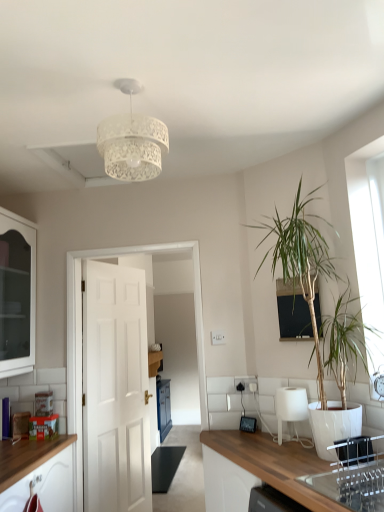
Question: Does black glass window screen at upper center have a greater height compared to white matte door at center?

Choices:
 (A) yes
 (B) no

Answer: (B)

Question: Is the position of black glass window screen at upper center more distant than that of white matte door at center?

Choices:
 (A) yes
 (B) no

Answer: (B)

Question: From a real-world perspective, does black glass window screen at upper center stand above white matte door at center?

Choices:
 (A) no
 (B) yes

Answer: (B)

Question: From the image's perspective, does black glass window screen at upper center appear higher than white matte door at center?

Choices:
 (A) yes
 (B) no

Answer: (A)

Question: Can you confirm if black glass window screen at upper center is positioned to the left of white matte door at center?

Choices:
 (A) no
 (B) yes

Answer: (A)

Question: Relative to black glass window screen at upper center, is clear glass sink at lower right in front or behind?

Choices:
 (A) behind
 (B) front

Answer: (B)

Question: Based on their sizes in the image, would you say clear glass sink at lower right is bigger or smaller than black glass window screen at upper center?

Choices:
 (A) small
 (B) big

Answer: (B)

Question: Considering the relative positions of clear glass sink at lower right and black glass window screen at upper center in the image provided, is clear glass sink at lower right to the left or to the right of black glass window screen at upper center?

Choices:
 (A) right
 (B) left

Answer: (A)

Question: Is clear glass sink at lower right wider or thinner than black glass window screen at upper center?

Choices:
 (A) thin
 (B) wide

Answer: (B)

Question: Considering the positions of point (304, 215) and point (21, 254), is point (304, 215) closer or farther from the camera than point (21, 254)?

Choices:
 (A) farther
 (B) closer

Answer: (B)

Question: Do you think green leafy plant at right is within white glass cabinet at left, or outside of it?

Choices:
 (A) outside
 (B) inside

Answer: (A)

Question: Considering the positions of green leafy plant at right and white glass cabinet at left in the image, is green leafy plant at right wider or thinner than white glass cabinet at left?

Choices:
 (A) wide
 (B) thin

Answer: (B)

Question: Visually, is green leafy plant at right positioned to the left or to the right of white glass cabinet at left?

Choices:
 (A) right
 (B) left

Answer: (A)

Question: From a real-world perspective, is white lace lampshade at upper center above or below white glass cabinet at left?

Choices:
 (A) below
 (B) above

Answer: (B)

Question: In terms of height, does white lace lampshade at upper center look taller or shorter compared to white glass cabinet at left?

Choices:
 (A) short
 (B) tall

Answer: (A)